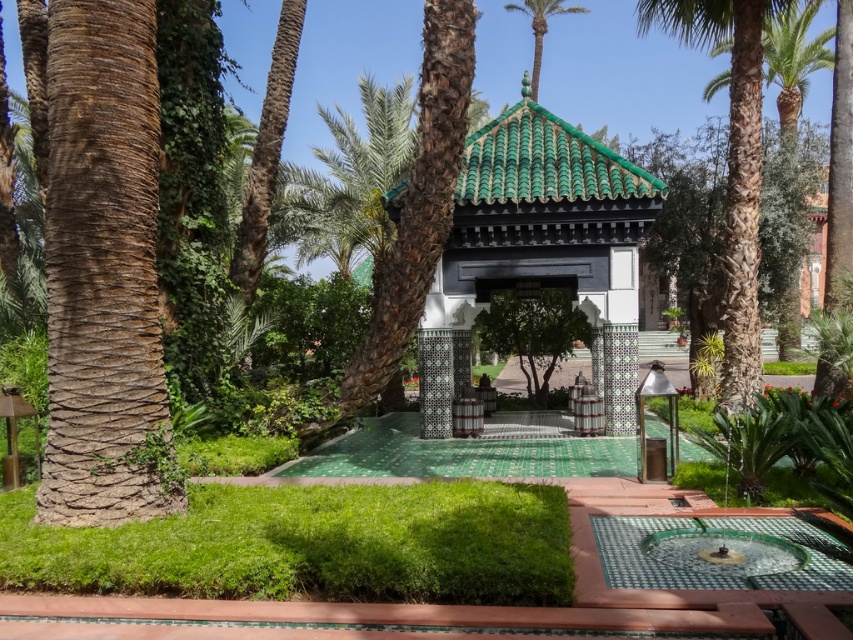
You are a gardener in the Moroccan garden and need to water the green lush grass at lower left. Which direction should you walk from the brown rough bark palm at left to reach it?

The green lush grass at lower left is to the right of the brown rough bark palm at left, so you should walk to the right to reach it.

You are planning to install a new lighting system in the garden. The lights are designed to be mounted on structures that are at least 3 meters tall. Based on the scene, can the green glazed tile gazebo at center and the green leafy palm tree at right both accommodate the lights?

The green glazed tile gazebo at center is not as tall as the green leafy palm tree at right. Since the gazebo is shorter than the palm tree, and the minimum height requirement is 3 meters, we need to check if the palm tree meets the height. However, without knowing the exact height of the palm tree, it is uncertain if either structure can accommodate the lights. Please provide the specific height of the palm tree for an accurate assessment.